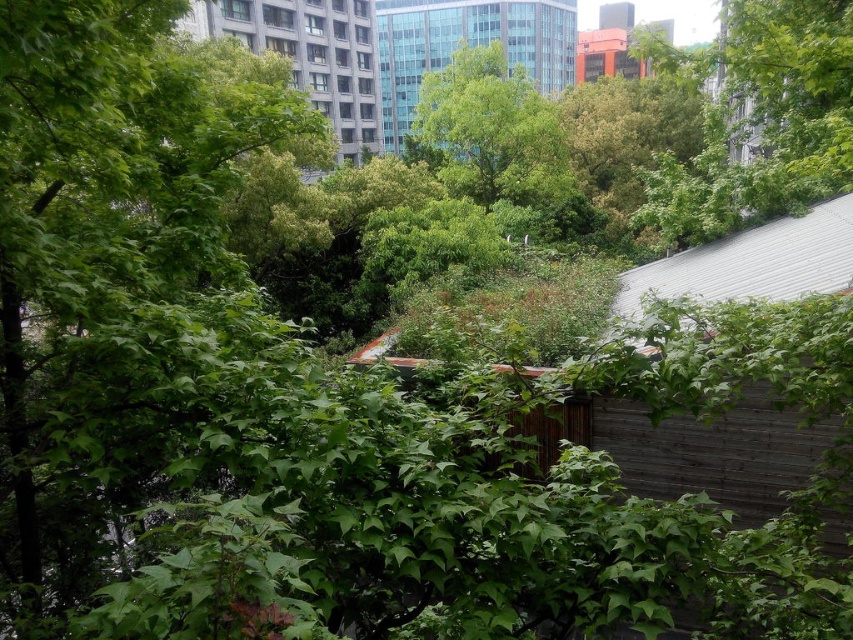
Who is taller, transparent glass building at upper center or wooden hut at upper center?

wooden hut at upper center

This screenshot has height=640, width=853. What do you see at coordinates (468, 45) in the screenshot?
I see `transparent glass building at upper center` at bounding box center [468, 45].

The width and height of the screenshot is (853, 640). Describe the element at coordinates (468, 45) in the screenshot. I see `transparent glass building at upper center` at that location.

This screenshot has width=853, height=640. Identify the location of transparent glass building at upper center. [x=468, y=45].

Can you confirm if wooden hut at upper center is wider than matte orange building at upper center?

In fact, wooden hut at upper center might be narrower than matte orange building at upper center.

How distant is wooden hut at upper center from matte orange building at upper center?

They are 106.10 feet apart.

Does point (312, 26) come farther from viewer compared to point (576, 49)?

No, (312, 26) is in front of (576, 49).

Find the location of a particular element. The height and width of the screenshot is (640, 853). wooden hut at upper center is located at coordinates (310, 54).

Between point (409, 125) and point (669, 264), which one is positioned behind?

Point (409, 125)

Find the location of a particular element. Image resolution: width=853 pixels, height=640 pixels. transparent glass building at upper center is located at coordinates [468, 45].